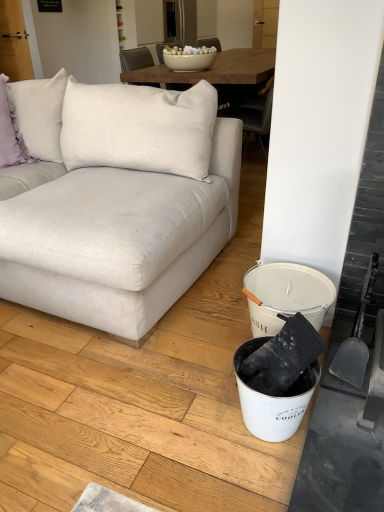
This screenshot has width=384, height=512. What are the coordinates of `vacant area that is in front of white matte bucket at lower right` in the screenshot? It's located at (253, 481).